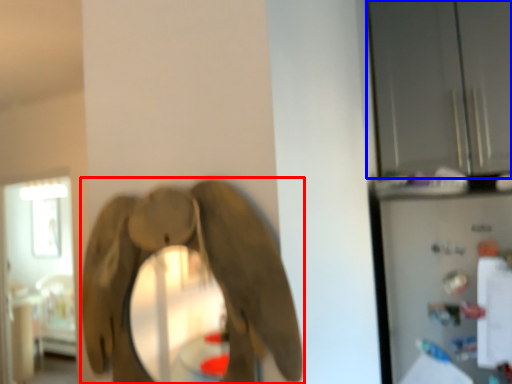
Question: Among these objects, which one is farthest to the camera, elephant (highlighted by a red box) or glass door (highlighted by a blue box)?

Choices:
 (A) elephant
 (B) glass door

Answer: (B)